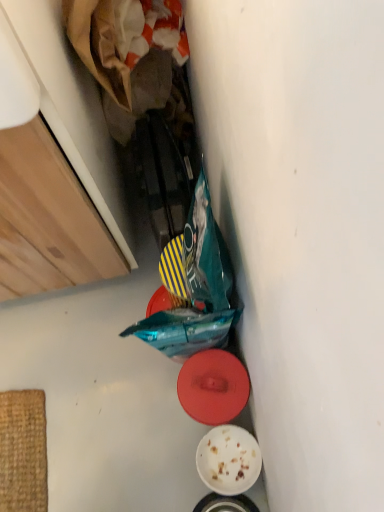
Question: Which direction should I rotate to face red matte plate at center, which is the 1th plate in top-to-bottom order, — up or down?

Choices:
 (A) up
 (B) down

Answer: (B)

Question: Can you confirm if red matte plate at center, the second plate ordered from the bottom, is positioned to the left of white matte plate at lower center, the 2th plate viewed from the top?

Choices:
 (A) yes
 (B) no

Answer: (A)

Question: Considering the relative sizes of red matte plate at center, the second plate ordered from the bottom, and white matte plate at lower center, which is the first plate from bottom to top, in the image provided, is red matte plate at center, the second plate ordered from the bottom, wider than white matte plate at lower center, which is the first plate from bottom to top,?

Choices:
 (A) no
 (B) yes

Answer: (B)

Question: From the image's perspective, is red matte plate at center, the second plate ordered from the bottom, beneath white matte plate at lower center, which is the first plate from bottom to top?

Choices:
 (A) yes
 (B) no

Answer: (B)

Question: Considering the relative sizes of red matte plate at center, the second plate ordered from the bottom, and white matte plate at lower center, which is the first plate from bottom to top, in the image provided, is red matte plate at center, the second plate ordered from the bottom, thinner than white matte plate at lower center, which is the first plate from bottom to top,?

Choices:
 (A) yes
 (B) no

Answer: (B)

Question: Considering the relative positions of red matte plate at center, the second plate ordered from the bottom, and white matte plate at lower center, the 2th plate viewed from the top, in the image provided, is red matte plate at center, the second plate ordered from the bottom, in front of white matte plate at lower center, the 2th plate viewed from the top,?

Choices:
 (A) yes
 (B) no

Answer: (A)

Question: Is red matte plate at center, the second plate ordered from the bottom, facing towards white matte plate at lower center, which is the first plate from bottom to top?

Choices:
 (A) yes
 (B) no

Answer: (B)

Question: From a real-world perspective, is white matte plate at lower center, the 2th plate viewed from the top, beneath red matte plate at center, the second plate ordered from the bottom?

Choices:
 (A) yes
 (B) no

Answer: (A)

Question: From the image's perspective, would you say white matte plate at lower center, the 2th plate viewed from the top, is shown under red matte plate at center, which is the 1th plate in top-to-bottom order?

Choices:
 (A) yes
 (B) no

Answer: (A)

Question: Is white matte plate at lower center, the 2th plate viewed from the top, directly adjacent to red matte plate at center, the second plate ordered from the bottom?

Choices:
 (A) no
 (B) yes

Answer: (A)

Question: Can you confirm if white matte plate at lower center, which is the first plate from bottom to top, is wider than red matte plate at center, the second plate ordered from the bottom?

Choices:
 (A) no
 (B) yes

Answer: (A)

Question: Are white matte plate at lower center, which is the first plate from bottom to top, and red matte plate at center, the second plate ordered from the bottom, far apart?

Choices:
 (A) yes
 (B) no

Answer: (B)

Question: Considering the relative sizes of white matte plate at lower center, which is the first plate from bottom to top, and red matte plate at center, which is the 1th plate in top-to-bottom order, in the image provided, is white matte plate at lower center, which is the first plate from bottom to top, bigger than red matte plate at center, which is the 1th plate in top-to-bottom order,?

Choices:
 (A) yes
 (B) no

Answer: (B)

Question: In the image, is red matte plate at center, the second plate ordered from the bottom, positioned in front of or behind white matte plate at lower center, the 2th plate viewed from the top?

Choices:
 (A) behind
 (B) front

Answer: (B)